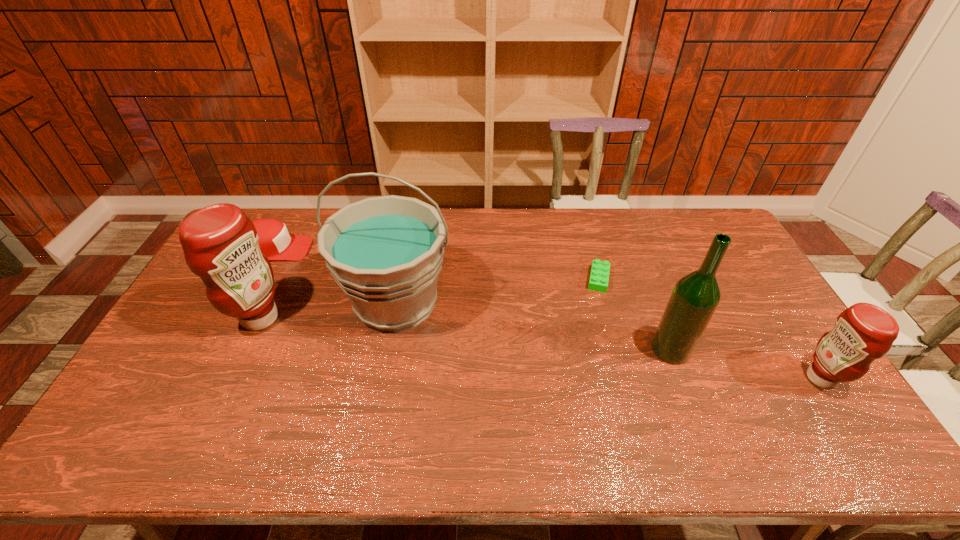
If equal spacing is desired by inserting an extra condiment among them, please point out a free spot for this new condiment. Please provide its 2D coordinates. Your answer should be formatted as a tuple, i.e. [(x, y)], where the tuple contains the x and y coordinates of a point satisfying the conditions above.

[(523, 346)]